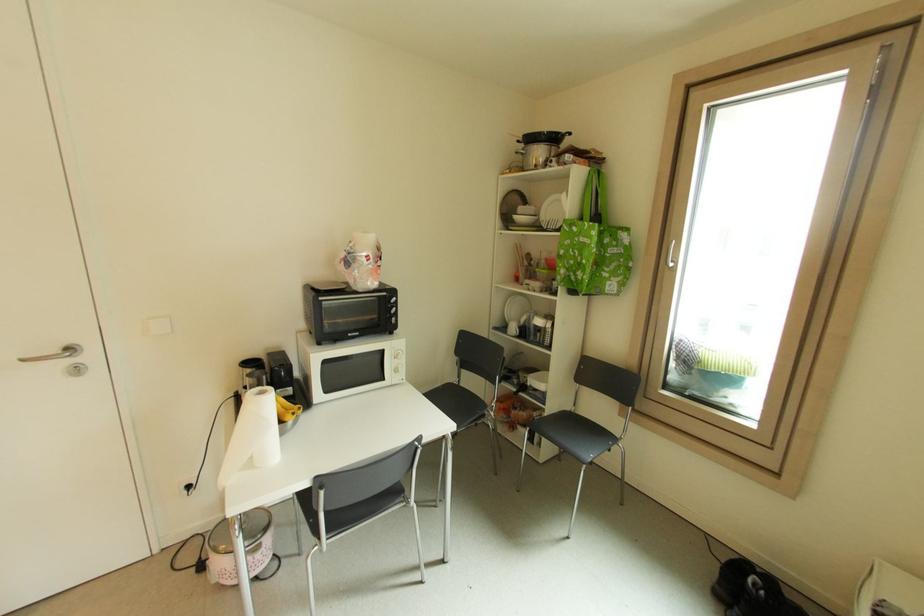
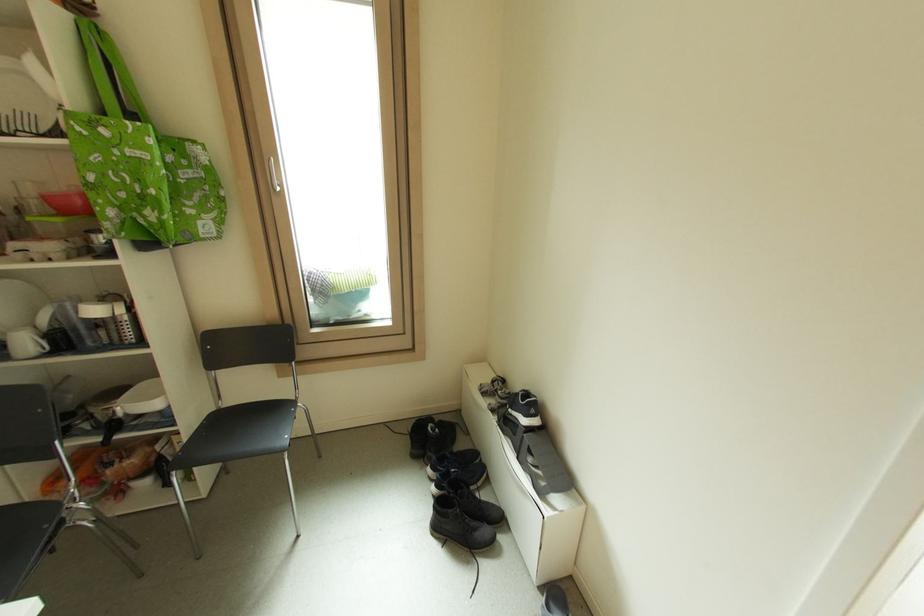
Locate, in the second image, the point that corresponds to point (574, 410) in the first image.

(220, 408)